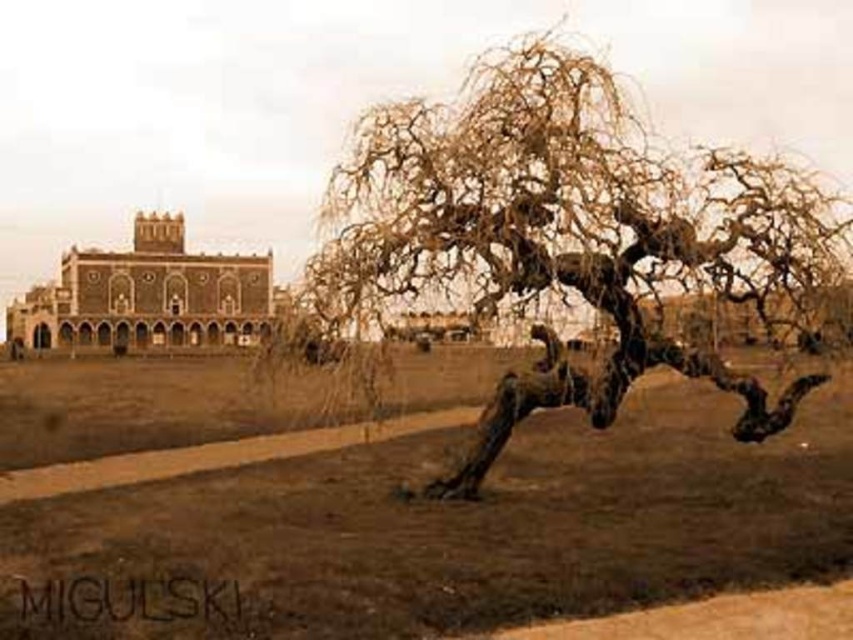
You are an architect planning to build a new garden path that leads from the brown stone palace at upper left to the brown textured tree at center. Based on their positions, which direction should the path initially head?

The brown textured tree at center is to the right of the brown stone palace at upper left, so the path should initially head to the right from the brown stone palace at upper left towards the brown textured tree at center.

You are a surveyor measuring distances between landmarks in a park. You have a map that shows the brown textured tree at center and the brown dirt field at center. According to your measurements, how far apart are these two landmarks?

The brown dirt field at center is 26.34 meters from brown textured tree at center, so the distance between them is 26.34 meters.

You are an architect examining this image. You need to determine the spatial relationship between the brown textured tree at center and the brown stone palace at upper left. Which object is positioned higher in the image?

The brown textured tree at center is located above the brown stone palace at upper left, meaning it is positioned higher in the image.